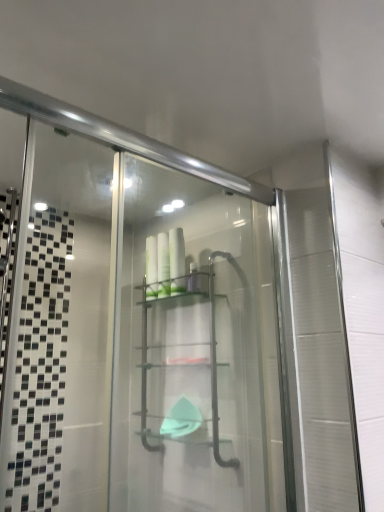
Question: Is white glossy bottles at center, the 2th toiletry viewed from the left, outside of clear plastic shelf at center?

Choices:
 (A) no
 (B) yes

Answer: (A)

Question: From a real-world perspective, is white glossy bottles at center, the 2th toiletry viewed from the left, physically below clear plastic shelf at center?

Choices:
 (A) no
 (B) yes

Answer: (A)

Question: Can you confirm if white glossy bottles at center, the 2th toiletry viewed from the left, is bigger than clear plastic shelf at center?

Choices:
 (A) yes
 (B) no

Answer: (B)

Question: Is white glossy bottles at center, the 1th toiletry in the right-to-left sequence, thinner than clear plastic shelf at center?

Choices:
 (A) no
 (B) yes

Answer: (B)

Question: Is white glossy bottles at center, the 1th toiletry in the right-to-left sequence, to the right of clear plastic shelf at center from the viewer's perspective?

Choices:
 (A) no
 (B) yes

Answer: (B)

Question: Which is correct: white glossy bottles at center, which is the first toiletry from left to right, is inside white glossy bottles at center, the 2th toiletry viewed from the left, or outside of it?

Choices:
 (A) outside
 (B) inside

Answer: (A)

Question: Is white glossy bottles at center, which is the first toiletry from left to right, taller or shorter than white glossy bottles at center, the 2th toiletry viewed from the left?

Choices:
 (A) short
 (B) tall

Answer: (A)

Question: From the image's perspective, relative to white glossy bottles at center, the 1th toiletry in the right-to-left sequence, is white glossy bottles at center, the 2th toiletry from the right, above or below?

Choices:
 (A) above
 (B) below

Answer: (B)

Question: Is white glossy bottles at center, which is the first toiletry from left to right, to the left or to the right of white glossy bottles at center, the 2th toiletry viewed from the left, in the image?

Choices:
 (A) right
 (B) left

Answer: (B)

Question: Is white glossy bottles at center, the 2th toiletry viewed from the left, situated inside white glossy bottles at center, the 2th toiletry from the right, or outside?

Choices:
 (A) inside
 (B) outside

Answer: (B)

Question: In terms of height, does white glossy bottles at center, the 2th toiletry viewed from the left, look taller or shorter compared to white glossy bottles at center, which is the first toiletry from left to right?

Choices:
 (A) short
 (B) tall

Answer: (A)

Question: In terms of width, does white glossy bottles at center, the 2th toiletry viewed from the left, look wider or thinner when compared to white glossy bottles at center, which is the first toiletry from left to right?

Choices:
 (A) wide
 (B) thin

Answer: (A)

Question: From the image's perspective, relative to white glossy bottles at center, the 2th toiletry from the right, is white glossy bottles at center, the 2th toiletry viewed from the left, above or below?

Choices:
 (A) above
 (B) below

Answer: (A)

Question: In the image, is clear plastic shelf at center positioned in front of or behind white glossy bottles at center, the 2th toiletry viewed from the left?

Choices:
 (A) behind
 (B) front

Answer: (B)

Question: Does point (142, 345) appear closer or farther from the camera than point (163, 254)?

Choices:
 (A) closer
 (B) farther

Answer: (B)